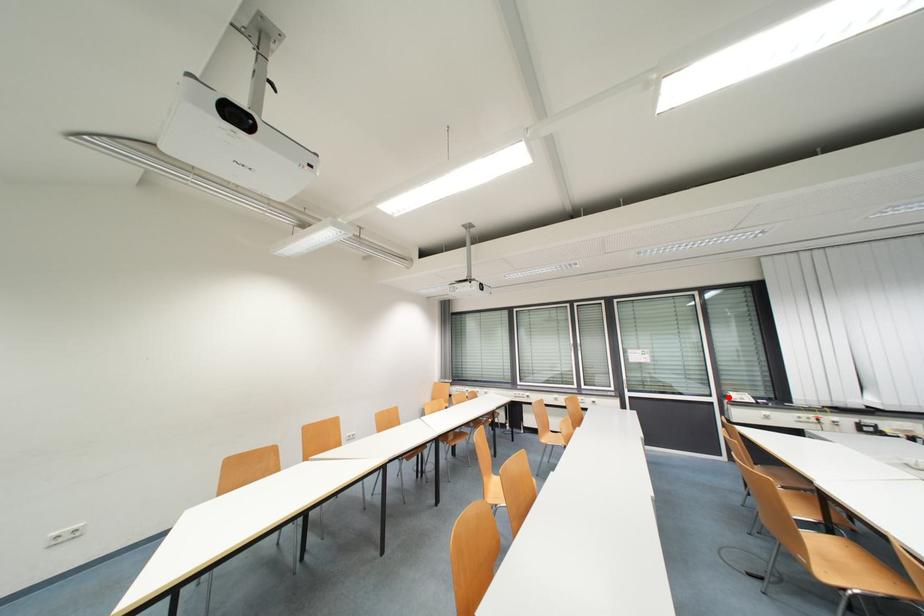
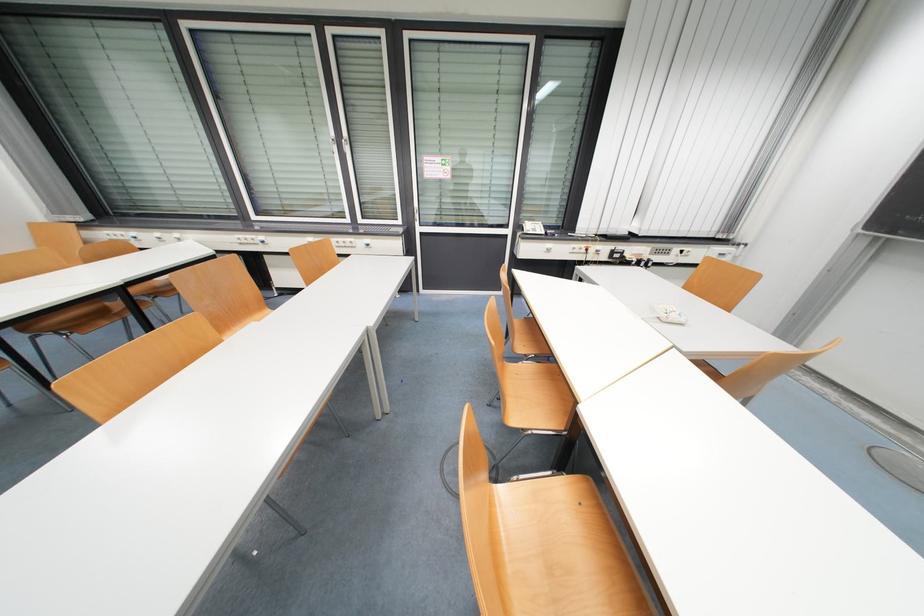
Question: I am providing you with two images of the same scene from different viewpoints. A red point is shown in image1. For the corresponding object point in image2, is it positioned nearer or farther from the camera?

Choices:
 (A) Nearer
 (B) Farther

Answer: (A)